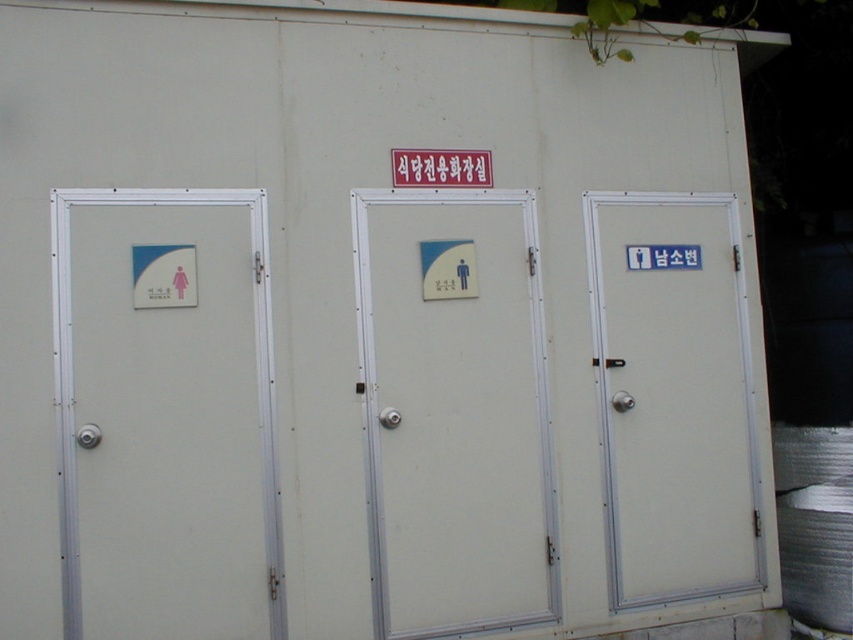
Question: Does white matte door at left have a smaller size compared to white matte door at center?

Choices:
 (A) yes
 (B) no

Answer: (A)

Question: Considering the real-world distances, which object is closest to the white matte door at right?

Choices:
 (A) white matte door at center
 (B) white plastic sign at center

Answer: (A)

Question: Is white matte door at center closer to camera compared to white plastic sign at center?

Choices:
 (A) yes
 (B) no

Answer: (A)

Question: Which of these objects is positioned farthest from the white matte door at center?

Choices:
 (A) white matte door at right
 (B) white matte door at left

Answer: (B)

Question: Which point appears closest to the camera in this image?

Choices:
 (A) (433, 340)
 (B) (152, 266)
 (C) (729, 448)
 (D) (437, 154)

Answer: (B)

Question: Is white matte door at right wider than white plastic sign at center?

Choices:
 (A) yes
 (B) no

Answer: (A)